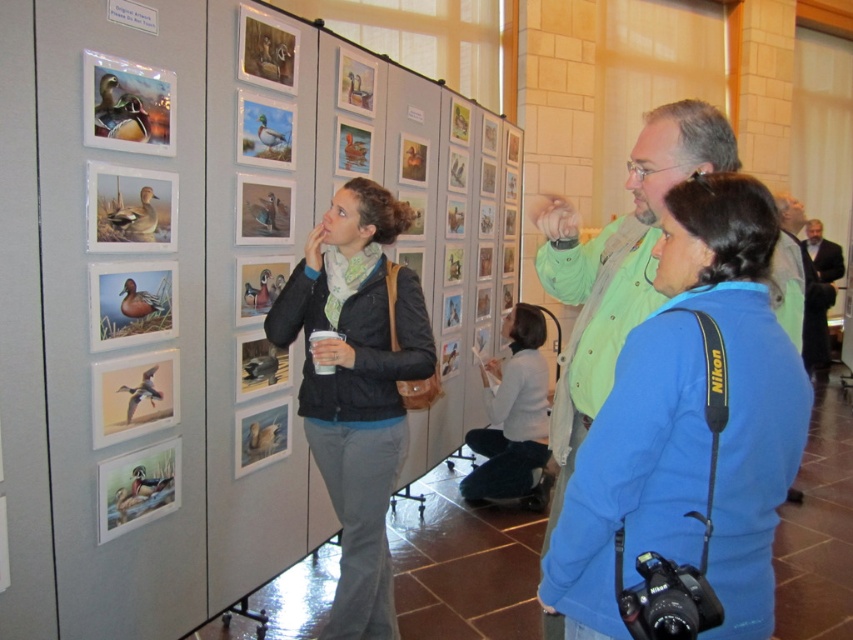
Question: Is blue fabric jacket at center closer to camera compared to dark suit at right?

Choices:
 (A) no
 (B) yes

Answer: (B)

Question: Is black matte jacket at center to the right of dark suit at right from the viewer's perspective?

Choices:
 (A) no
 (B) yes

Answer: (A)

Question: Which object is positioned closest to the black matte jacket at center?

Choices:
 (A) white matte jacket at center
 (B) dark suit at right
 (C) blue fabric jacket at center

Answer: (C)

Question: Which of the following is the closest to the observer?

Choices:
 (A) dark suit at right
 (B) white matte jacket at center
 (C) blue fabric jacket at center

Answer: (C)

Question: Is black matte jacket at center smaller than white matte jacket at center?

Choices:
 (A) yes
 (B) no

Answer: (B)

Question: Based on their relative distances, which object is farther from the black matte jacket at center?

Choices:
 (A) dark suit at right
 (B) white matte jacket at center
 (C) blue fabric jacket at center

Answer: (A)